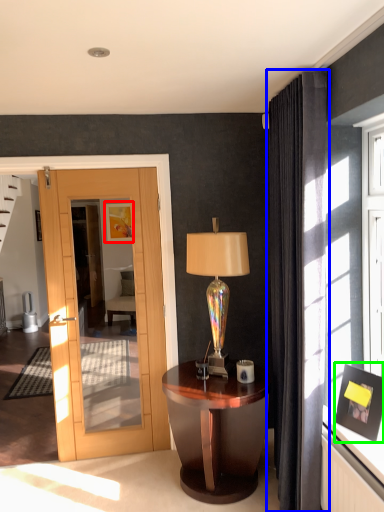
Question: Which object is the farthest from picture frame (highlighted by a red box)? Choose among these: curtain (highlighted by a blue box) or picture frame (highlighted by a green box).

Choices:
 (A) curtain
 (B) picture frame

Answer: (B)